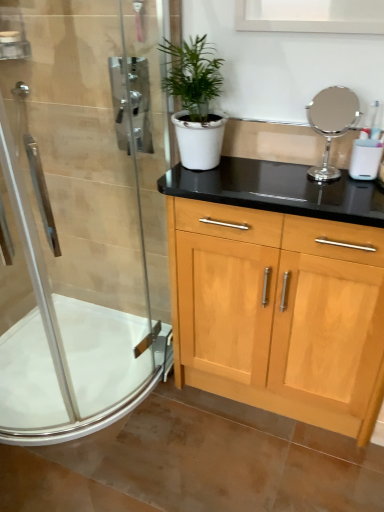
Question: Does polished chrome mirror at upper right lie behind white glossy bath at lower left?

Choices:
 (A) no
 (B) yes

Answer: (A)

Question: Does polished chrome mirror at upper right touch white glossy bath at lower left?

Choices:
 (A) yes
 (B) no

Answer: (B)

Question: From the image's perspective, would you say polished chrome mirror at upper right is shown under white glossy bath at lower left?

Choices:
 (A) yes
 (B) no

Answer: (B)

Question: Does polished chrome mirror at upper right appear on the right side of white glossy bath at lower left?

Choices:
 (A) yes
 (B) no

Answer: (A)

Question: Can you confirm if polished chrome mirror at upper right is wider than white glossy bath at lower left?

Choices:
 (A) yes
 (B) no

Answer: (B)

Question: Is clear glass shower door at left wider or thinner than polished chrome mirror at upper right?

Choices:
 (A) wide
 (B) thin

Answer: (A)

Question: Considering the positions of clear glass shower door at left and polished chrome mirror at upper right in the image, is clear glass shower door at left bigger or smaller than polished chrome mirror at upper right?

Choices:
 (A) small
 (B) big

Answer: (B)

Question: From a real-world perspective, is clear glass shower door at left above or below polished chrome mirror at upper right?

Choices:
 (A) above
 (B) below

Answer: (B)

Question: Considering the relative positions of clear glass shower door at left and polished chrome mirror at upper right in the image provided, is clear glass shower door at left to the left or to the right of polished chrome mirror at upper right?

Choices:
 (A) left
 (B) right

Answer: (A)

Question: From a real-world perspective, is white matte pot at center above or below white glossy bath at lower left?

Choices:
 (A) below
 (B) above

Answer: (B)

Question: Is white matte pot at center wider or thinner than white glossy bath at lower left?

Choices:
 (A) wide
 (B) thin

Answer: (B)

Question: Is white matte pot at center to the left or to the right of white glossy bath at lower left in the image?

Choices:
 (A) right
 (B) left

Answer: (A)

Question: From the image's perspective, is white matte pot at center positioned above or below white glossy bath at lower left?

Choices:
 (A) below
 (B) above

Answer: (B)

Question: In terms of height, does polished chrome mirror at upper right look taller or shorter compared to clear glass shower door at left?

Choices:
 (A) short
 (B) tall

Answer: (A)

Question: Visually, is polished chrome mirror at upper right positioned to the left or to the right of clear glass shower door at left?

Choices:
 (A) left
 (B) right

Answer: (B)